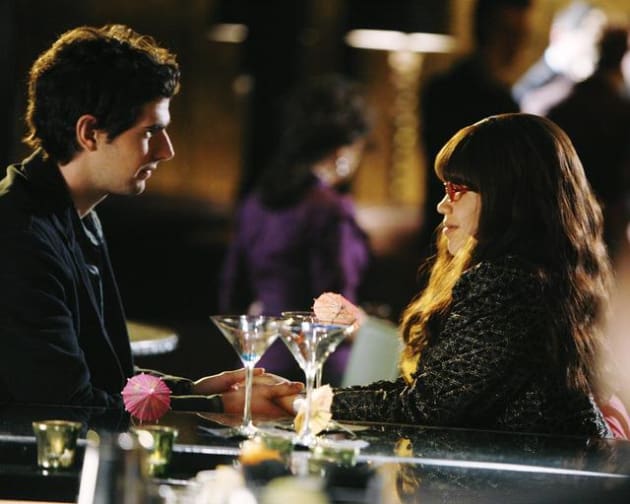
This screenshot has height=504, width=630. In order to click on light in this screenshot , I will do `click(385, 40)`.